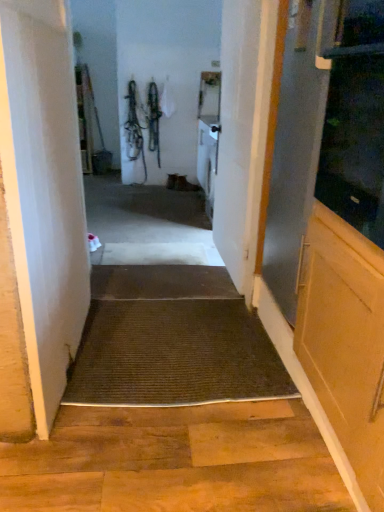
Question: Which direction should I rotate to look at brown textured mat at center, the second doormat when ordered from top to bottom, — up or down?

Choices:
 (A) down
 (B) up

Answer: (A)

Question: Is white wood door at center, acting as the second door starting from the left, oriented away from brown textured mat at center, which is the second doormat in back-to-front order?

Choices:
 (A) yes
 (B) no

Answer: (B)

Question: From a real-world perspective, is white wood door at center, acting as the second door starting from the left, over brown textured mat at center, the second doormat when ordered from top to bottom?

Choices:
 (A) no
 (B) yes

Answer: (B)

Question: Considering the relative sizes of white wood door at center, which ranks as the 1th door in right-to-left order, and brown textured mat at center, which ranks as the first doormat in bottom-to-top order, in the image provided, is white wood door at center, which ranks as the 1th door in right-to-left order, smaller than brown textured mat at center, which ranks as the first doormat in bottom-to-top order,?

Choices:
 (A) no
 (B) yes

Answer: (A)

Question: Is white wood door at center, acting as the second door starting from the left, not near brown textured mat at center, the second doormat when ordered from top to bottom?

Choices:
 (A) no
 (B) yes

Answer: (A)

Question: Does white wood door at center, acting as the second door starting from the left, contain brown textured mat at center, arranged as the first doormat when viewed from the front?

Choices:
 (A) no
 (B) yes

Answer: (A)

Question: From a real-world perspective, does white wood door at center, which ranks as the 1th door in right-to-left order, sit lower than brown textured mat at center, arranged as the first doormat when viewed from the front?

Choices:
 (A) yes
 (B) no

Answer: (B)

Question: Is white wood door at center, acting as the second door starting from the left, to the right of brown textured mat at center, the first doormat when ordered from back to front, from the viewer's perspective?

Choices:
 (A) yes
 (B) no

Answer: (A)

Question: From the image's perspective, is white wood door at center, acting as the second door starting from the left, below brown textured mat at center, the 1th doormat in the top-to-bottom sequence?

Choices:
 (A) no
 (B) yes

Answer: (A)

Question: Is the depth of white wood door at center, which ranks as the 1th door in right-to-left order, greater than that of brown textured mat at center, the 2th doormat positioned from the bottom?

Choices:
 (A) no
 (B) yes

Answer: (A)

Question: Is white wood door at center, acting as the second door starting from the left, looking in the opposite direction of brown textured mat at center, placed as the 2th doormat when sorted from front to back?

Choices:
 (A) no
 (B) yes

Answer: (A)

Question: Is white wood door at center, which ranks as the 1th door in right-to-left order, taller than brown textured mat at center, the 1th doormat in the top-to-bottom sequence?

Choices:
 (A) yes
 (B) no

Answer: (A)

Question: From a real-world perspective, is white wood door at center, acting as the second door starting from the left, physically below brown textured mat at center, the 2th doormat positioned from the bottom?

Choices:
 (A) yes
 (B) no

Answer: (B)

Question: Can you confirm if transparent glass screen door at right, arranged as the first screen door when viewed from the back, is thinner than white wood door at center, acting as the second door starting from the left?

Choices:
 (A) yes
 (B) no

Answer: (B)